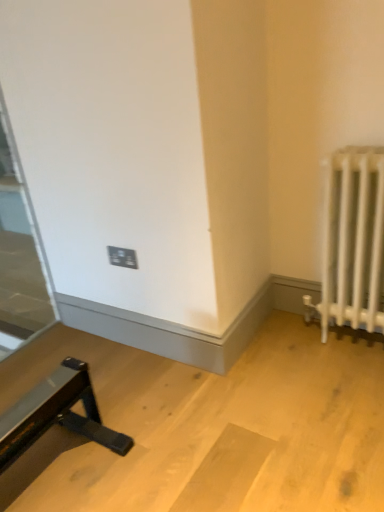
Where is `free spot in front of white metal radiator at right`? free spot in front of white metal radiator at right is located at coordinates (351, 368).